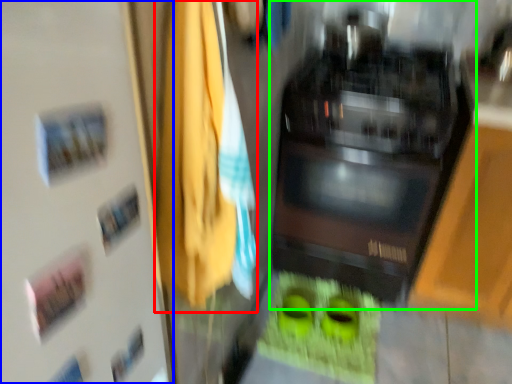
Question: Which object is the farthest from laundry (highlighted by a red box)? Choose among these: door (highlighted by a blue box) or home appliance (highlighted by a green box).

Choices:
 (A) door
 (B) home appliance

Answer: (B)